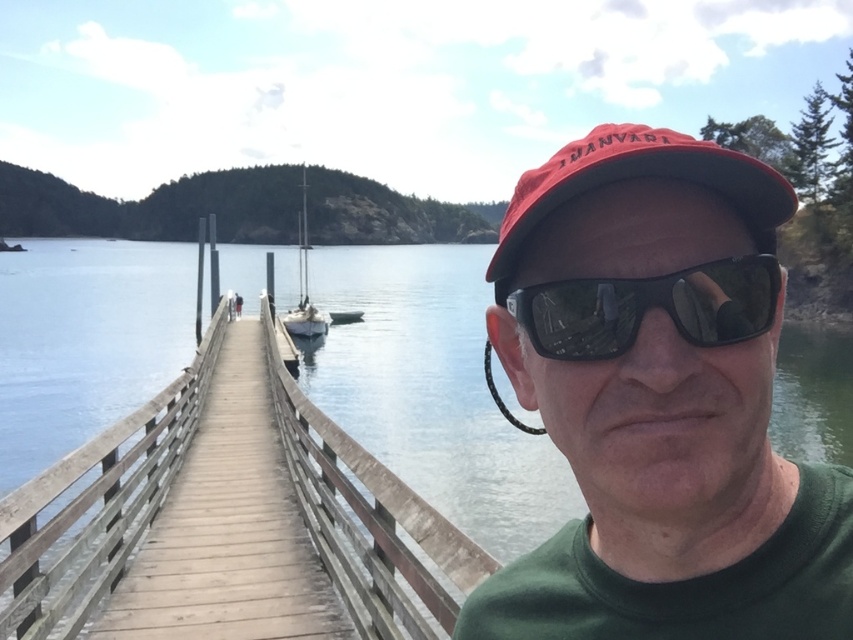
Question: Among these points, which one is farthest from the camera?

Choices:
 (A) (585, 152)
 (B) (688, 304)

Answer: (A)

Question: Is the position of brown wooden rail at center more distant than that of red matte baseball cap at upper center?

Choices:
 (A) no
 (B) yes

Answer: (B)

Question: Estimate the real-world distances between objects in this image. Which object is closer to the red matte baseball cap at upper center?

Choices:
 (A) black reflective sunglasses at center
 (B) white matte sailboat at center

Answer: (A)

Question: Which is farther from the white matte sailboat at center?

Choices:
 (A) black reflective sunglasses at center
 (B) matte red cap at center

Answer: (A)

Question: Can you confirm if brown wooden rail at center is positioned to the right of white matte sailboat at center?

Choices:
 (A) yes
 (B) no

Answer: (A)

Question: Is brown wooden rail at center thinner than black reflective sunglasses at center?

Choices:
 (A) no
 (B) yes

Answer: (A)